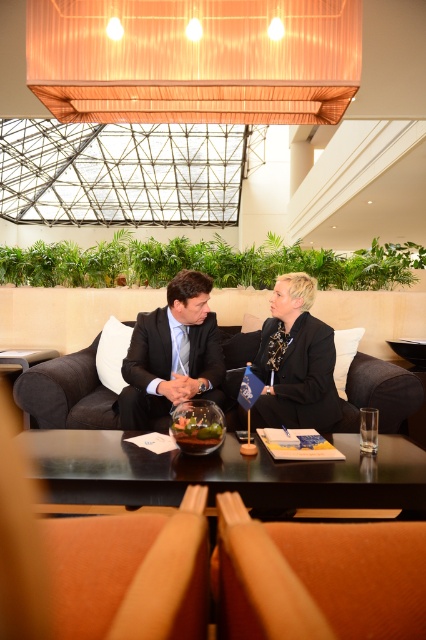
You are an interior designer assessing the seating arrangement in the meeting area. The black fabric couch at center and the dark blue fabric business suit at center are both in the same room. Which object takes up more space in the room?

The black fabric couch at center is bigger than the dark blue fabric business suit at center, so it takes up more space in the room.

Based on the photo, you are standing in the lounge area and see the point at coordinates (x=66, y=394). What object is located at that point?

The point at coordinates (x=66, y=394) is located on the black fabric couch at center.

You are a guest attending a formal event and need to sit down. You see the black fabric couch at center and the black matte suit at center. Which one is smaller in size?

The black fabric couch at center has a smaller size compared to the black matte suit at center, so the black fabric couch at center is smaller.